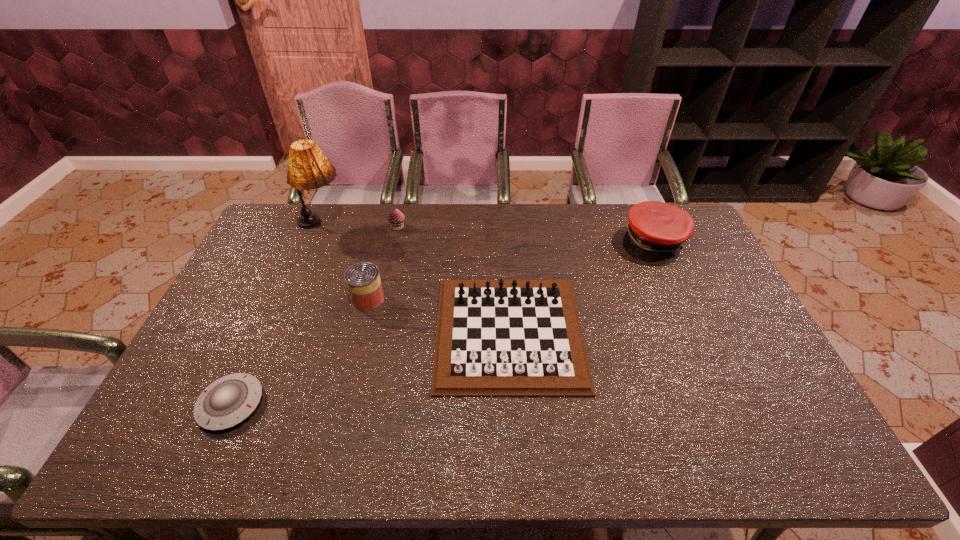
This screenshot has height=540, width=960. What are the coordinates of `lampshade` in the screenshot? It's located at (308, 168).

Where is `cap`? The width and height of the screenshot is (960, 540). cap is located at coordinates (656, 229).

The image size is (960, 540). In order to click on can in this screenshot , I will do `click(363, 281)`.

This screenshot has width=960, height=540. I want to click on cupcake, so click(396, 218).

You are a GUI agent. You are given a task and a screenshot of the screen. Output one action in this format:
    pyautogui.click(x=<x>, y=<y>)
    Task: Click on the second object from right to left
    The height and width of the screenshot is (540, 960).
    Given the screenshot: What is the action you would take?
    pyautogui.click(x=495, y=338)

At what (x,y) coordinates should I click in order to perform the action: click on saucer. Please return your answer as a coordinate pair (x, y). The height and width of the screenshot is (540, 960). Looking at the image, I should click on (229, 400).

You are a GUI agent. You are given a task and a screenshot of the screen. Output one action in this format:
    pyautogui.click(x=<x>, y=<y>)
    Task: Click on the vacant area located on the front-facing side of the lampshade
    This screenshot has height=540, width=960.
    Given the screenshot: What is the action you would take?
    pyautogui.click(x=386, y=225)

Locate an element on the screen. vacant space located 0.170m on the front-facing side of the cap is located at coordinates (678, 299).

Locate an element on the screen. vacant region located 0.340m on the back of the can is located at coordinates (387, 223).

The height and width of the screenshot is (540, 960). In order to click on vacant space situated 0.060m on the back of the cupcake in this screenshot , I will do `click(400, 212)`.